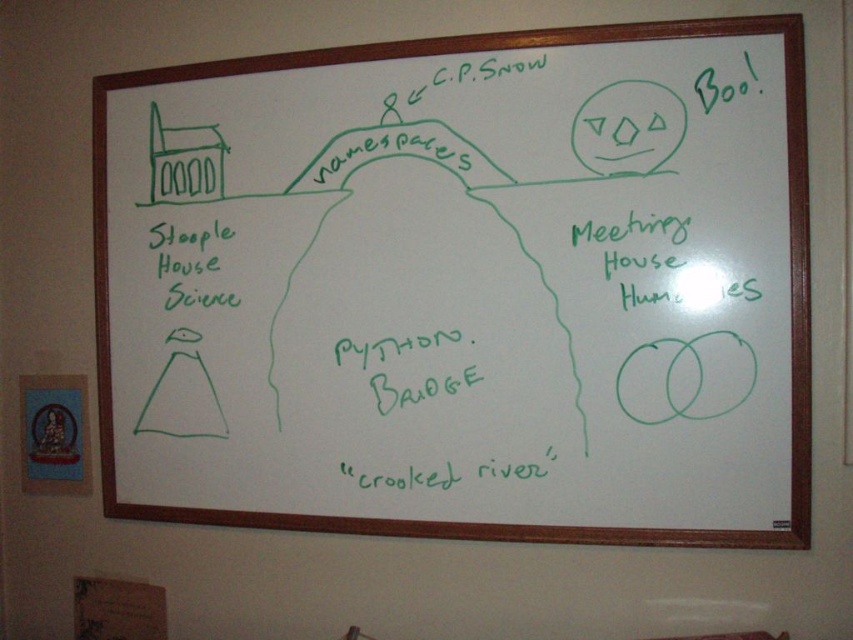
Question: Which point is closer to the camera?

Choices:
 (A) green marker text at left
 (B) whiteboard at upper center

Answer: (B)

Question: Does whiteboard at upper center have a greater width compared to green marker text at left?

Choices:
 (A) no
 (B) yes

Answer: (B)

Question: Is whiteboard at upper center behind green marker text at left?

Choices:
 (A) yes
 (B) no

Answer: (B)

Question: Can you confirm if whiteboard at upper center is smaller than green marker text at left?

Choices:
 (A) yes
 (B) no

Answer: (B)

Question: Which point is farther to the camera?

Choices:
 (A) (175, 248)
 (B) (357, 195)

Answer: (A)